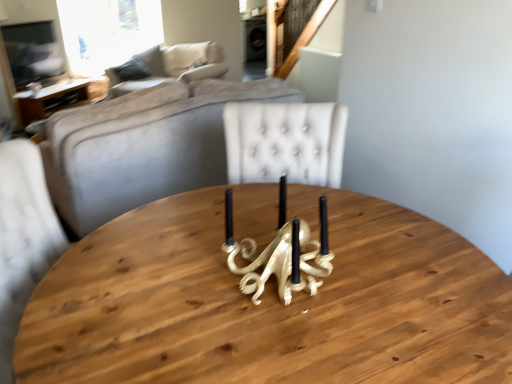
Measure the distance between point (x=80, y=83) and camera.

The depth of point (x=80, y=83) is 5.18 meters.

Find the location of `wooden table at left`. wooden table at left is located at coordinates (52, 99).

The height and width of the screenshot is (384, 512). What are the coordinates of `gold metallic octopus at center` in the screenshot? It's located at (284, 257).

This screenshot has width=512, height=384. Describe the element at coordinates (284, 257) in the screenshot. I see `gold metallic octopus at center` at that location.

Locate an element on the screen. This screenshot has height=384, width=512. wooden table at left is located at coordinates (52, 99).

From the image's perspective, is beige fabric couch at upper left located above beige fabric pillow at upper center?

No, from the image's perspective, beige fabric couch at upper left is not over beige fabric pillow at upper center.

Looking at this image, is beige fabric couch at upper left wider or thinner than beige fabric pillow at upper center?

Considering their sizes, beige fabric couch at upper left looks broader than beige fabric pillow at upper center.

Does beige fabric couch at upper left have a greater height compared to beige fabric pillow at upper center?

Indeed, beige fabric couch at upper left has a greater height compared to beige fabric pillow at upper center.

Can you tell me how much beige fabric couch at upper left and beige fabric pillow at upper center differ in facing direction?

They differ by 3.85 degrees in their facing directions.

Is gold metallic octopus at center oriented away from wooden table at left?

No.

Considering the sizes of objects gold metallic octopus at center and wooden table at left in the image provided, who is thinner, gold metallic octopus at center or wooden table at left?

gold metallic octopus at center is thinner.

Is wooden table at left outside of gold metallic octopus at center?

Yes, wooden table at left is outside of gold metallic octopus at center.

This screenshot has height=384, width=512. In order to click on table on the left of gold metallic octopus at center in this screenshot , I will do `click(52, 99)`.

Considering the relative positions of wooden table at left and gold metallic octopus at center in the image provided, is wooden table at left behind gold metallic octopus at center?

Yes.

Which of these two, wooden table at left or gold metallic octopus at center, is thinner?

With smaller width is gold metallic octopus at center.

Does gold metallic octopus at center turn towards beige fabric couch at upper left?

No, gold metallic octopus at center does not turn towards beige fabric couch at upper left.

Which is more to the left, gold metallic octopus at center or beige fabric couch at upper left?

From the viewer's perspective, beige fabric couch at upper left appears more on the left side.

Could beige fabric couch at upper left be considered to be inside gold metallic octopus at center?

No, beige fabric couch at upper left is not surrounded by gold metallic octopus at center.

Based on the photo, who is more distant, gold metallic octopus at center or beige fabric couch at upper left?

beige fabric couch at upper left.

Where is `pillow that is behind the gold metallic octopus at center`? This screenshot has width=512, height=384. pillow that is behind the gold metallic octopus at center is located at coordinates 184,57.

Based on the photo, considering the relative sizes of gold metallic octopus at center and beige fabric pillow at upper center in the image provided, is gold metallic octopus at center smaller than beige fabric pillow at upper center?

Yes.

Which is in front, gold metallic octopus at center or beige fabric pillow at upper center?

gold metallic octopus at center.

Looking at their sizes, would you say gold metallic octopus at center is wider or thinner than beige fabric pillow at upper center?

gold metallic octopus at center is thinner than beige fabric pillow at upper center.

How many degrees apart are the facing directions of beige fabric pillow at upper center and beige fabric couch at upper left?

3.85 degrees separate the facing orientations of beige fabric pillow at upper center and beige fabric couch at upper left.

Is beige fabric pillow at upper center at the right side of beige fabric couch at upper left?

Indeed, beige fabric pillow at upper center is positioned on the right side of beige fabric couch at upper left.

Who is more distant, beige fabric pillow at upper center or beige fabric couch at upper left?

beige fabric pillow at upper center is further away from the camera.

The image size is (512, 384). In order to click on couch below the beige fabric pillow at upper center (from the image's perspective) in this screenshot , I will do (x=172, y=66).

Does wooden table at left have a smaller size compared to beige fabric couch at upper left?

Yes, wooden table at left is smaller than beige fabric couch at upper left.

At what (x,y) coordinates should I click in order to perform the action: click on couch in front of the wooden table at left. Please return your answer as a coordinate pair (x, y). Looking at the image, I should click on (172, 66).

Is wooden table at left not within beige fabric couch at upper left?

Indeed, wooden table at left is completely outside beige fabric couch at upper left.

You are a GUI agent. You are given a task and a screenshot of the screen. Output one action in this format:
    pyautogui.click(x=<x>, y=<y>)
    Task: Click on the pillow on the right of beige fabric couch at upper left
    
    Given the screenshot: What is the action you would take?
    pyautogui.click(x=184, y=57)

Identify the location of table above the gold metallic octopus at center (from the image's perspective). The image size is (512, 384). (52, 99).

Which object lies further to the anchor point gold metallic octopus at center, beige fabric couch at upper left or wooden table at left?

Based on the image, beige fabric couch at upper left appears to be further to gold metallic octopus at center.

Which object lies nearer to the anchor point wooden table at left, gold metallic octopus at center or beige fabric pillow at upper center?

Based on the image, beige fabric pillow at upper center appears to be nearer to wooden table at left.

Looking at the image, which one is located closer to beige fabric pillow at upper center, beige fabric couch at upper left or wooden table at left?

beige fabric couch at upper left.

When comparing their distances from beige fabric pillow at upper center, does gold metallic octopus at center or beige fabric couch at upper left seem closer?

beige fabric couch at upper left lies closer to beige fabric pillow at upper center than the other object.

Estimate the real-world distances between objects in this image. Which object is closer to beige fabric couch at upper left, wooden table at left or beige fabric pillow at upper center?

The object closer to beige fabric couch at upper left is beige fabric pillow at upper center.

Estimate the real-world distances between objects in this image. Which object is closer to beige fabric pillow at upper center, beige fabric couch at upper left or gold metallic octopus at center?

beige fabric couch at upper left.

Looking at the image, which one is located closer to gold metallic octopus at center, wooden table at left or beige fabric couch at upper left?

wooden table at left lies closer to gold metallic octopus at center than the other object.

Considering their positions, is beige fabric couch at upper left positioned further to wooden table at left than gold metallic octopus at center?

The object further to wooden table at left is gold metallic octopus at center.

Locate an element on the screen. The width and height of the screenshot is (512, 384). table positioned between gold metallic octopus at center and beige fabric pillow at upper center from near to far is located at coordinates (52, 99).

Identify the location of couch positioned between gold metallic octopus at center and wooden table at left from near to far. (172, 66).

The height and width of the screenshot is (384, 512). I want to click on couch between gold metallic octopus at center and beige fabric pillow at upper center from front to back, so click(x=172, y=66).

Where is `couch situated between wooden table at left and beige fabric pillow at upper center from left to right`? This screenshot has width=512, height=384. couch situated between wooden table at left and beige fabric pillow at upper center from left to right is located at coordinates (172, 66).